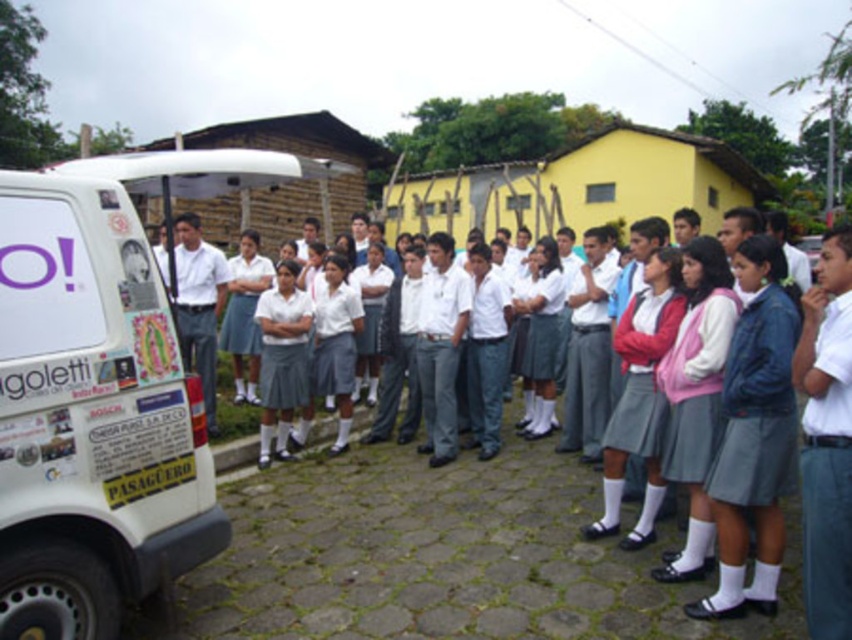
Does point (186, 540) lie behind point (315, 456)?

No, (186, 540) is in front of (315, 456).

Describe the element at coordinates (91, 416) in the screenshot. I see `white matte van at left` at that location.

The width and height of the screenshot is (852, 640). In order to click on white matte van at left in this screenshot , I will do `click(91, 416)`.